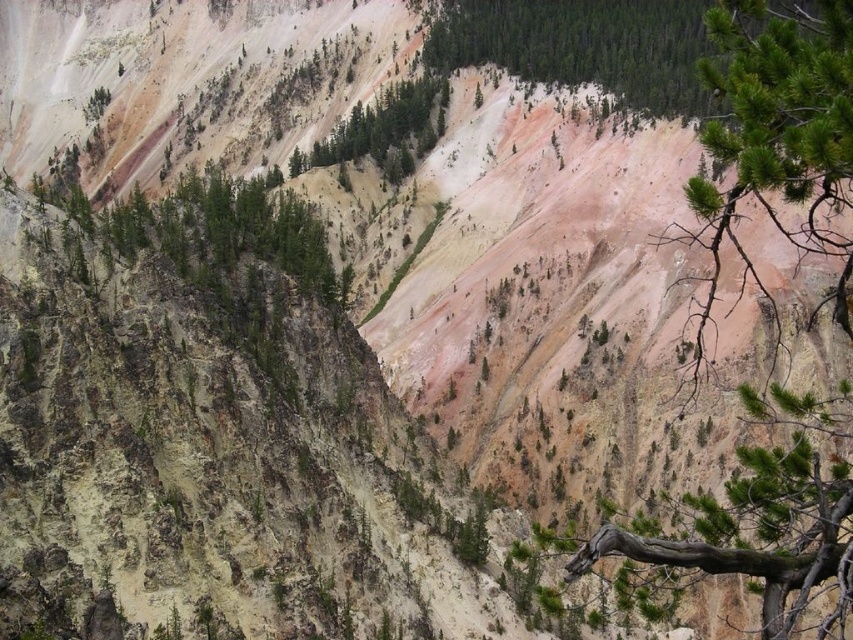
Image resolution: width=853 pixels, height=640 pixels. Describe the element at coordinates (776, 145) in the screenshot. I see `green textured pine branch at upper right` at that location.

What do you see at coordinates (776, 145) in the screenshot? I see `green textured pine branch at upper right` at bounding box center [776, 145].

I want to click on green textured pine branch at upper right, so click(776, 145).